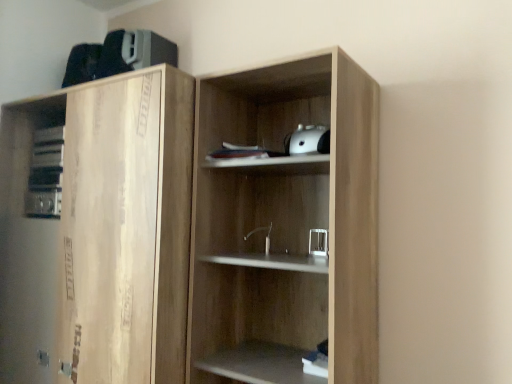
In order to face wooden cupboard at center, should I rotate leftwards or rightwards?

To face it directly, rotate right by 4.321 degrees.

The height and width of the screenshot is (384, 512). I want to click on wooden cupboard at center, so click(x=190, y=229).

Describe the element at coordinates (190, 229) in the screenshot. I see `wooden cupboard at center` at that location.

What is the approximate width of wooden cupboard at center?

wooden cupboard at center is 15.44 inches wide.

The width and height of the screenshot is (512, 384). What do you see at coordinates (97, 231) in the screenshot? I see `natural wood cabinet at left` at bounding box center [97, 231].

The image size is (512, 384). What are the coordinates of `natural wood cabinet at left` in the screenshot? It's located at (97, 231).

Measure the distance between point (187, 81) and camera.

The depth of point (187, 81) is 1.40 meters.

At what (x,y) coordinates should I click in order to perform the action: click on wooden cupboard at center. Please return your answer as a coordinate pair (x, y). The height and width of the screenshot is (384, 512). Looking at the image, I should click on (190, 229).

Which object is positioned more to the right, natural wood cabinet at left or wooden cupboard at center?

wooden cupboard at center is more to the right.

Considering the relative positions of natural wood cabinet at left and wooden cupboard at center in the image provided, is natural wood cabinet at left behind wooden cupboard at center?

That is True.

Which is further, [15,107] or [345,148]?

The point [15,107] is farther.

From the image's perspective, which one is positioned higher, natural wood cabinet at left or wooden cupboard at center?

wooden cupboard at center.

From a real-world perspective, is natural wood cabinet at left above or below wooden cupboard at center?

natural wood cabinet at left is below wooden cupboard at center.

Based on the photo, considering the relative sizes of natural wood cabinet at left and wooden cupboard at center in the image provided, is natural wood cabinet at left thinner than wooden cupboard at center?

No.

Considering the sizes of natural wood cabinet at left and wooden cupboard at center in the image, is natural wood cabinet at left taller or shorter than wooden cupboard at center?

In the image, natural wood cabinet at left appears to be taller than wooden cupboard at center.

Looking at this image, considering the sizes of objects natural wood cabinet at left and wooden cupboard at center in the image provided, who is smaller, natural wood cabinet at left or wooden cupboard at center?

wooden cupboard at center is smaller.

Is wooden cupboard at center surrounded by natural wood cabinet at left?

No, wooden cupboard at center is not inside natural wood cabinet at left.

Is natural wood cabinet at left with wooden cupboard at center?

No.

Is natural wood cabinet at left facing away from wooden cupboard at center?

No, natural wood cabinet at left's orientation is not away from wooden cupboard at center.

Can you tell me how much natural wood cabinet at left and wooden cupboard at center differ in facing direction?

0.703 degrees.

The width and height of the screenshot is (512, 384). Find the location of `cabinetry below the wooden cupboard at center (from a real-world perspective)`. cabinetry below the wooden cupboard at center (from a real-world perspective) is located at coordinates (97, 231).

Is wooden cupboard at center at the left side of natural wood cabinet at left?

No, wooden cupboard at center is not to the left of natural wood cabinet at left.

Considering the relative positions of wooden cupboard at center and natural wood cabinet at left in the image provided, is wooden cupboard at center in front of natural wood cabinet at left?

Yes, wooden cupboard at center is closer to the camera.

Is point (169, 127) positioned before point (131, 272)?

No, (169, 127) is further to viewer.

From the image's perspective, which one is positioned higher, wooden cupboard at center or natural wood cabinet at left?

wooden cupboard at center is shown above in the image.

From a real-world perspective, which is physically below, wooden cupboard at center or natural wood cabinet at left?

In real-world perspective, natural wood cabinet at left is lower.

Which of these two, wooden cupboard at center or natural wood cabinet at left, is thinner?

wooden cupboard at center.

Is wooden cupboard at center shorter than natural wood cabinet at left?

Yes.

Considering the relative sizes of wooden cupboard at center and natural wood cabinet at left in the image provided, is wooden cupboard at center smaller than natural wood cabinet at left?

Indeed, wooden cupboard at center has a smaller size compared to natural wood cabinet at left.

Can natural wood cabinet at left be found inside wooden cupboard at center?

No, natural wood cabinet at left is located outside of wooden cupboard at center.

Are wooden cupboard at center and natural wood cabinet at left beside each other?

No, wooden cupboard at center is not beside natural wood cabinet at left.

Is wooden cupboard at center oriented towards natural wood cabinet at left?

No, wooden cupboard at center is not facing towards natural wood cabinet at left.

Locate an element on the screen. Image resolution: width=512 pixels, height=384 pixels. cabinetry behind the wooden cupboard at center is located at coordinates tap(97, 231).

You are a GUI agent. You are given a task and a screenshot of the screen. Output one action in this format:
    pyautogui.click(x=<x>, y=<y>)
    Task: Click on the cupboard above the natural wood cabinet at left (from the image's perspective)
    
    Given the screenshot: What is the action you would take?
    pyautogui.click(x=190, y=229)

Locate an element on the screen. This screenshot has width=512, height=384. cabinetry that is under the wooden cupboard at center (from a real-world perspective) is located at coordinates click(x=97, y=231).